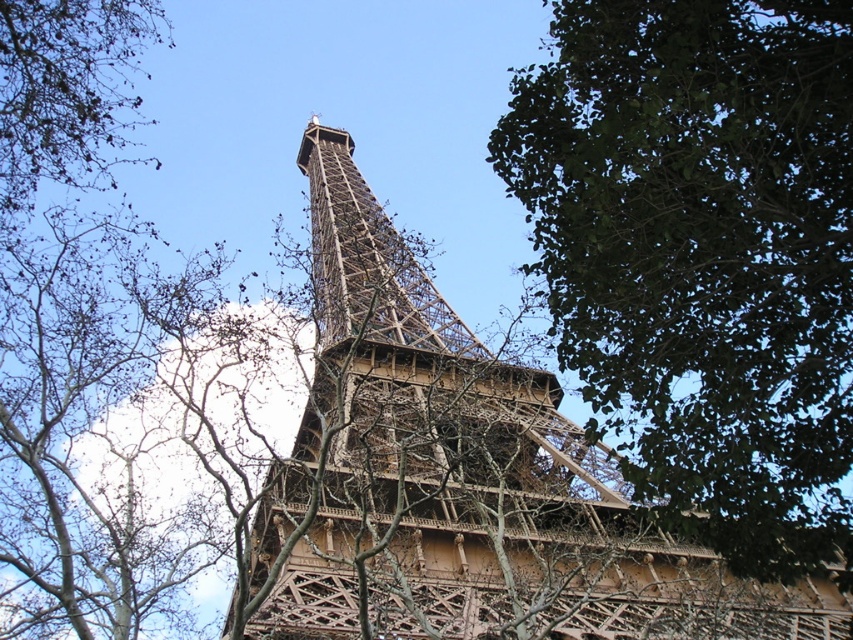
Question: Which point is closer to the camera taking this photo?

Choices:
 (A) (670, 248)
 (B) (519, 563)

Answer: (A)

Question: Is green leafy tree at center further to the viewer compared to brown metal eiffel tower at center?

Choices:
 (A) yes
 (B) no

Answer: (B)

Question: Can you confirm if green leafy tree at center is bigger than brown metal eiffel tower at center?

Choices:
 (A) yes
 (B) no

Answer: (B)

Question: Is green leafy tree at center to the right of brown metal eiffel tower at center from the viewer's perspective?

Choices:
 (A) no
 (B) yes

Answer: (B)

Question: Which of the following is the farthest from the observer?

Choices:
 (A) brown metal eiffel tower at center
 (B) green leafy tree at center

Answer: (A)